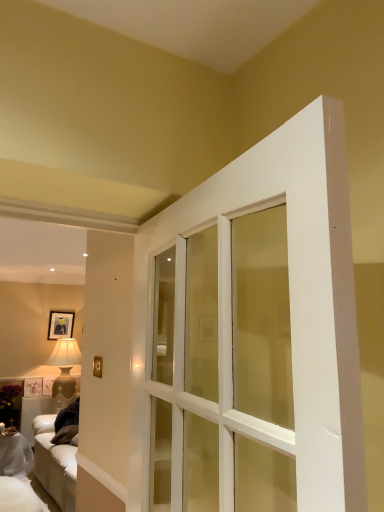
Question: Is matte beige lamp at left behind matte black picture frame at upper left?

Choices:
 (A) no
 (B) yes

Answer: (A)

Question: Is matte beige lamp at left bigger than matte black picture frame at upper left?

Choices:
 (A) no
 (B) yes

Answer: (B)

Question: Is matte beige lamp at left taller than matte black picture frame at upper left?

Choices:
 (A) yes
 (B) no

Answer: (A)

Question: Is matte beige lamp at left not near matte black picture frame at upper left?

Choices:
 (A) no
 (B) yes

Answer: (A)

Question: Does matte beige lamp at left appear on the left side of matte black picture frame at upper left?

Choices:
 (A) yes
 (B) no

Answer: (B)

Question: From a real-world perspective, is white fabric couch at lower left physically located above or below matte black picture frame at upper left?

Choices:
 (A) above
 (B) below

Answer: (B)

Question: Considering the relative positions of white fabric couch at lower left and matte black picture frame at upper left in the image provided, is white fabric couch at lower left to the left or to the right of matte black picture frame at upper left?

Choices:
 (A) right
 (B) left

Answer: (B)

Question: Considering the positions of white fabric couch at lower left and matte black picture frame at upper left in the image, is white fabric couch at lower left taller or shorter than matte black picture frame at upper left?

Choices:
 (A) short
 (B) tall

Answer: (B)

Question: Considering the positions of point (6, 468) and point (59, 324), is point (6, 468) closer or farther from the camera than point (59, 324)?

Choices:
 (A) farther
 (B) closer

Answer: (B)

Question: From the image's perspective, is white fabric couch at lower left located above or below matte beige lamp at left?

Choices:
 (A) below
 (B) above

Answer: (A)

Question: Relative to matte beige lamp at left, is white fabric couch at lower left in front or behind?

Choices:
 (A) behind
 (B) front

Answer: (B)

Question: Which is correct: white fabric couch at lower left is inside matte beige lamp at left, or outside of it?

Choices:
 (A) inside
 (B) outside

Answer: (B)

Question: From a real-world perspective, is white fabric couch at lower left above or below matte beige lamp at left?

Choices:
 (A) below
 (B) above

Answer: (A)

Question: From a real-world perspective, relative to white fabric couch at lower left, is matte black picture frame at upper left vertically above or below?

Choices:
 (A) above
 (B) below

Answer: (A)

Question: From the image's perspective, is matte black picture frame at upper left positioned above or below white fabric couch at lower left?

Choices:
 (A) below
 (B) above

Answer: (B)